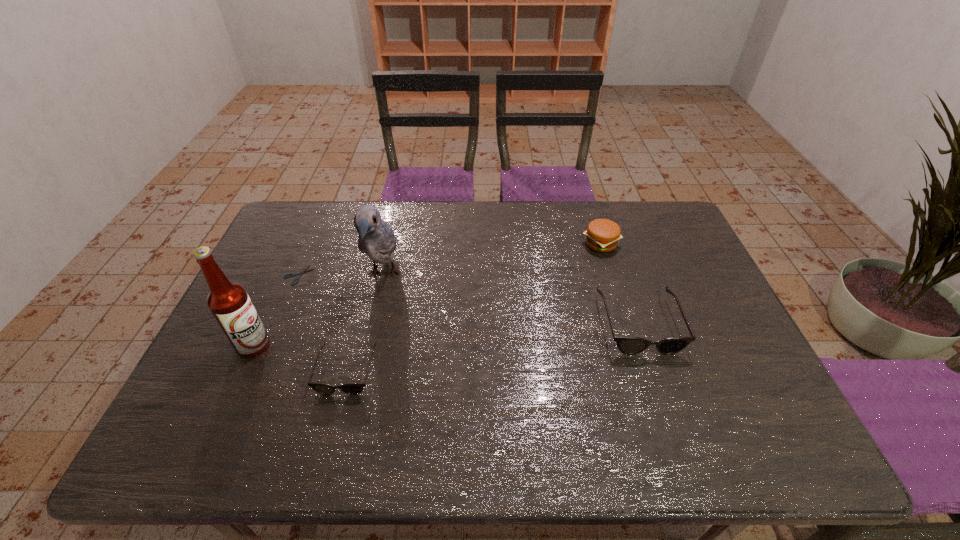
This screenshot has width=960, height=540. In order to click on free location located 0.120m on the front-facing side of the fifth shortest object in this screenshot , I will do `click(370, 336)`.

The height and width of the screenshot is (540, 960). I want to click on free space located 0.200m on the back of the shears, so click(320, 226).

Where is `object that is at the far edge`? object that is at the far edge is located at coordinates (602, 235).

This screenshot has width=960, height=540. I want to click on object that is at the near edge, so click(351, 388).

In order to click on alcohol located in the left edge section of the desktop in this screenshot , I will do `click(229, 302)`.

Image resolution: width=960 pixels, height=540 pixels. I want to click on shears that is at the left edge, so click(303, 271).

Locate an element on the screen. object at the right edge is located at coordinates (628, 345).

In the image, there is a desktop. In order to click on vacant region at the far edge in this screenshot , I will do `click(436, 203)`.

This screenshot has height=540, width=960. In order to click on free space at the near edge of the desktop in this screenshot , I will do `click(591, 388)`.

The width and height of the screenshot is (960, 540). What are the coordinates of `vacant space at the left edge of the desktop` in the screenshot? It's located at (263, 282).